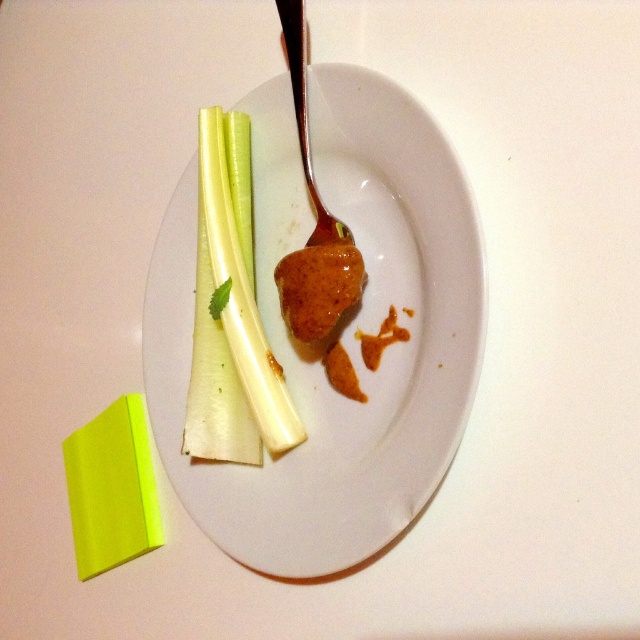
You are setting up a table for a picnic and have a white glossy plate at center and a neon yellow paper at lower left. Where should you place the napkin so that it is between them?

The napkin should be placed between the white glossy plate at center and the neon yellow paper at lower left, to the right of the neon yellow paper at lower left since the white glossy plate at center is to the right of it.

You are setting up a table for a dinner party and need to place a decorative napkin. Given the white glossy plate at center and the neon yellow paper at lower left, which item should you place the napkin under to ensure it stays in place?

The white glossy plate at center has a greater width than the neon yellow paper at lower left, so placing the napkin under the white glossy plate at center would provide a more stable base.